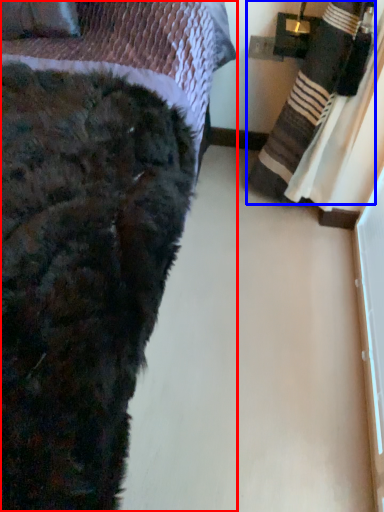
Question: Which point is closer to the camera, bed (highlighted by a red box) or blanket (highlighted by a blue box)?

Choices:
 (A) bed
 (B) blanket

Answer: (A)